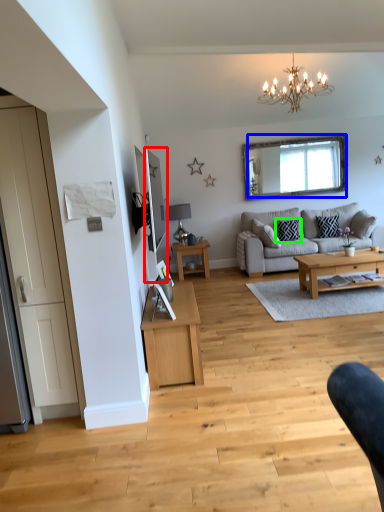
Question: Estimate the real-world distances between objects in this image. Which object is closer to mirror (highlighted by a red box), mirror (highlighted by a blue box) or pillow (highlighted by a green box)?

Choices:
 (A) mirror
 (B) pillow

Answer: (A)